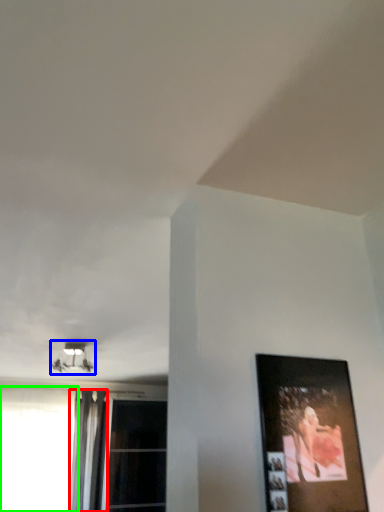
Question: Estimate the real-world distances between objects in this image. Which object is farther from curtain (highlighted by a red box), lamp (highlighted by a blue box) or window (highlighted by a green box)?

Choices:
 (A) lamp
 (B) window

Answer: (A)